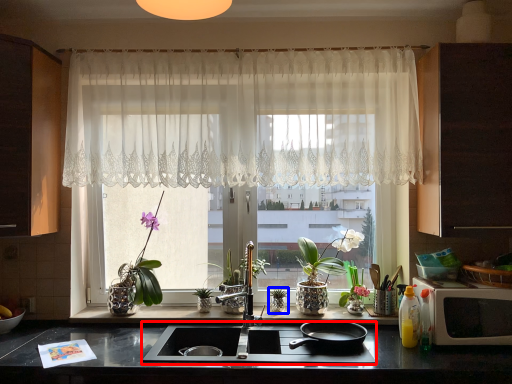
Question: Which object is closer to the camera taking this photo, gas stove (highlighted by a red box) or plant (highlighted by a blue box)?

Choices:
 (A) gas stove
 (B) plant

Answer: (A)